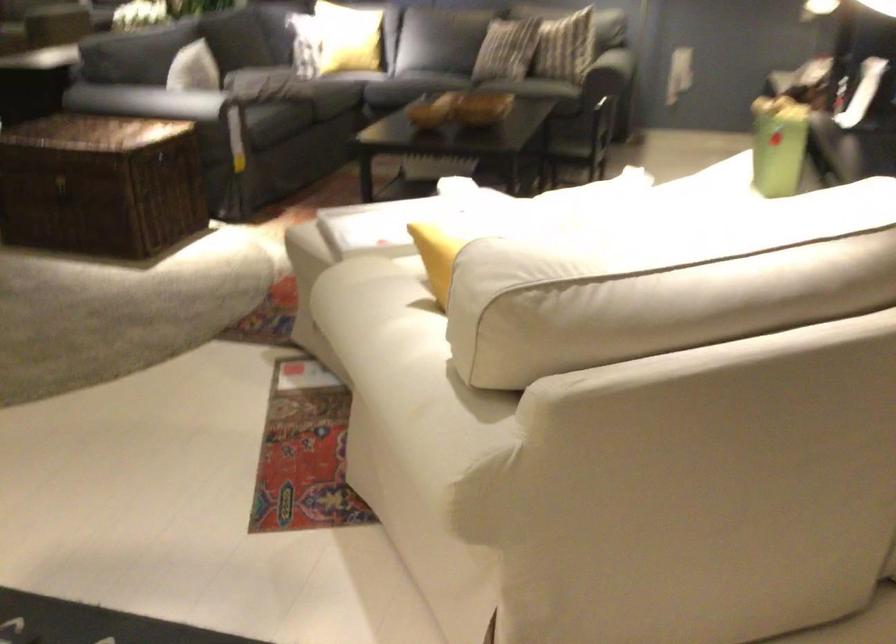
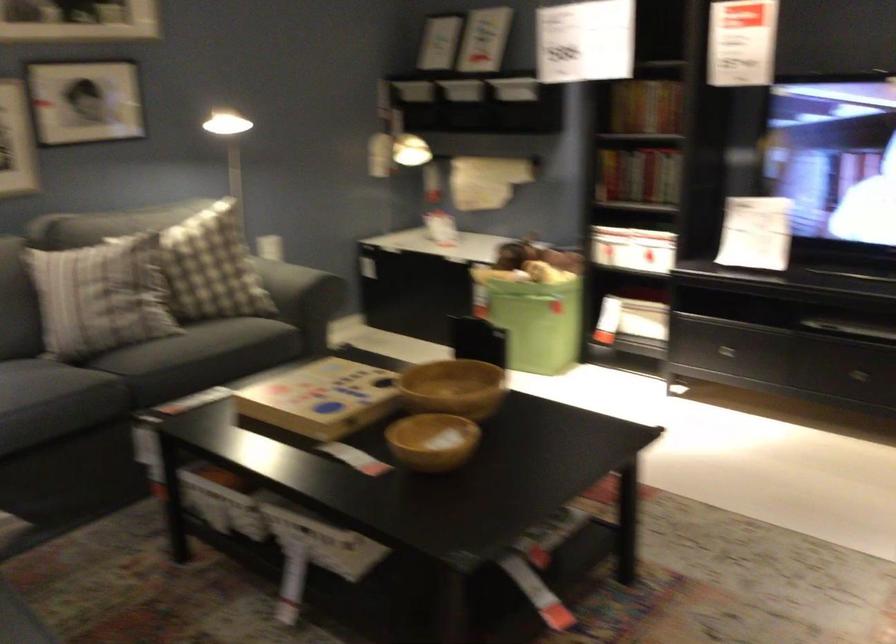
The point at (812,84) is marked in the first image. Where is the corresponding point in the second image?

(633, 249)